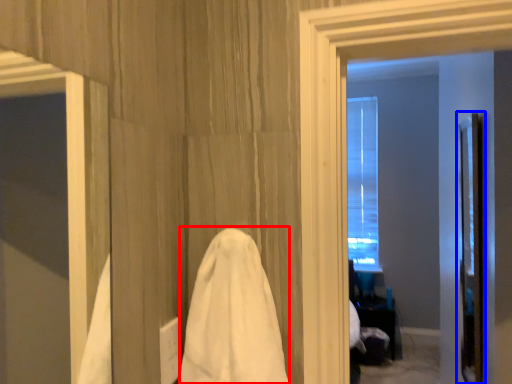
Question: Which point is closer to the camera, bath towel (highlighted by a red box) or screen door (highlighted by a blue box)?

Choices:
 (A) bath towel
 (B) screen door

Answer: (A)